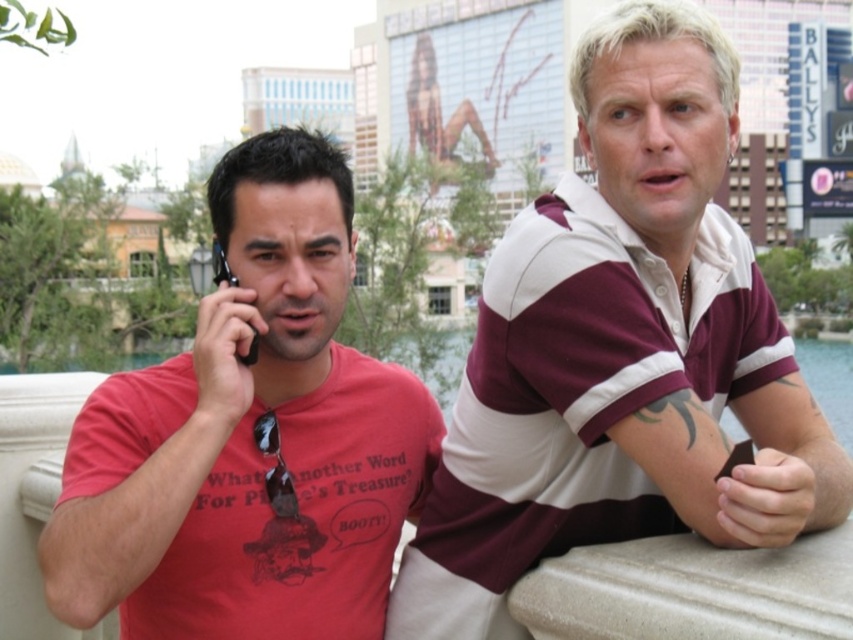
Question: Which point is closer to the camera?

Choices:
 (A) matte red t-shirt at left
 (B) maroon striped polo shirt at center

Answer: (B)

Question: Among these objects, which one is farthest from the camera?

Choices:
 (A) matte red t-shirt at left
 (B) maroon striped polo shirt at center

Answer: (A)

Question: Is maroon striped polo shirt at center thinner than matte red t-shirt at left?

Choices:
 (A) yes
 (B) no

Answer: (B)

Question: Does maroon striped polo shirt at center appear under matte red t-shirt at left?

Choices:
 (A) no
 (B) yes

Answer: (A)

Question: Which object is farther from the camera taking this photo?

Choices:
 (A) matte red t-shirt at left
 (B) maroon striped polo shirt at center

Answer: (A)

Question: Does maroon striped polo shirt at center have a smaller size compared to matte red t-shirt at left?

Choices:
 (A) yes
 (B) no

Answer: (B)